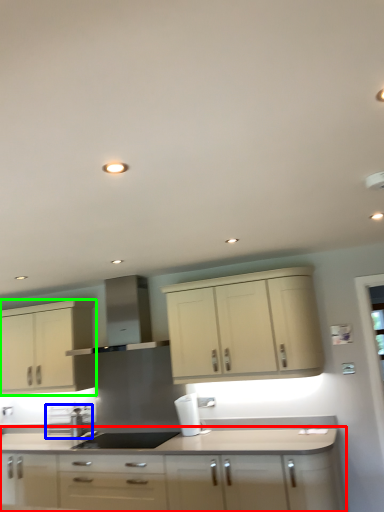
Question: Which object is positioned closest to cabinetry (highlighted by a red box)? Select from appliance (highlighted by a blue box) and cabinetry (highlighted by a green box).

Choices:
 (A) appliance
 (B) cabinetry

Answer: (B)